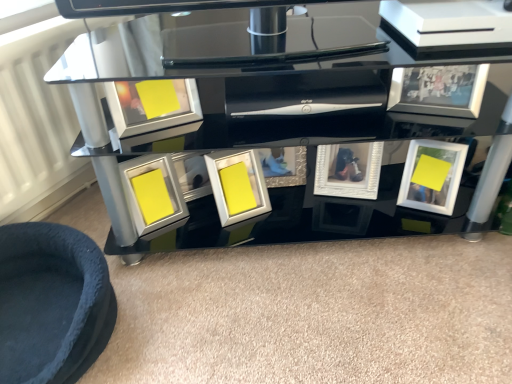
You are a GUI agent. You are given a task and a screenshot of the screen. Output one action in this format:
    pyautogui.click(x=<x>, y=<y>)
    Task: Click on the vacant point to the left of white textured frame at center, placed as the fourth picture frame when sorted from left to right
    
    Given the screenshot: What is the action you would take?
    298,208